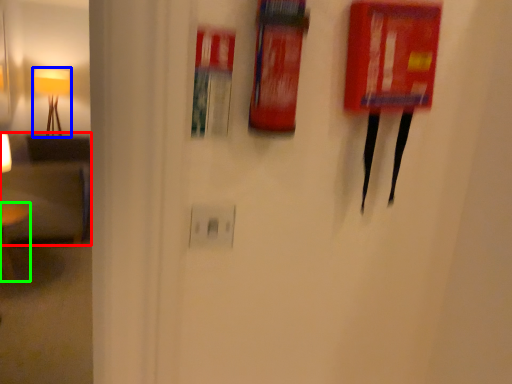
Question: Estimate the real-world distances between objects in this image. Which object is farther from armchair (highlighted by a red box), lamp (highlighted by a blue box) or furniture (highlighted by a green box)?

Choices:
 (A) lamp
 (B) furniture

Answer: (A)